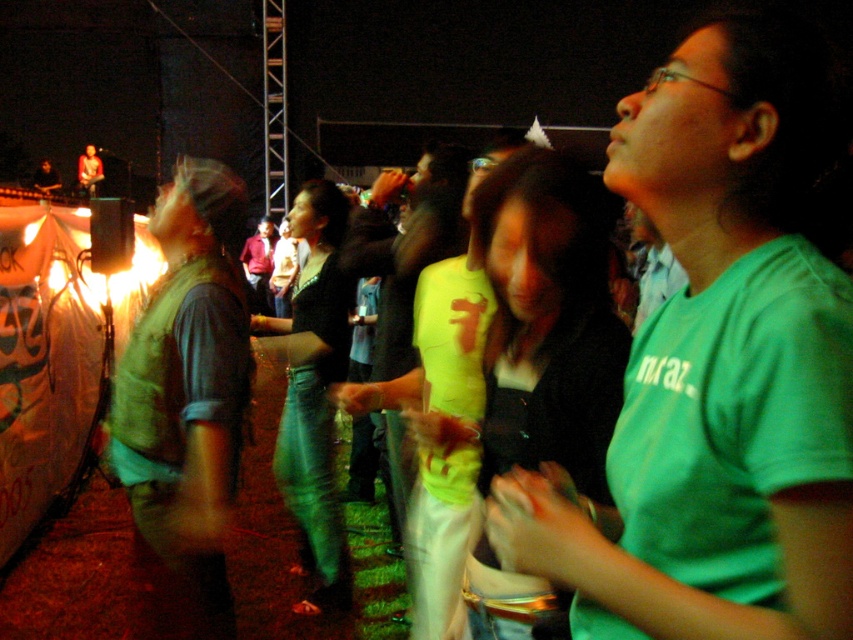
Is green matte shirt at upper right above green matte vest at left?

Correct, green matte shirt at upper right is located above green matte vest at left.

Looking at this image, does green matte shirt at upper right appear on the left side of green matte vest at left?

No, green matte shirt at upper right is not to the left of green matte vest at left.

At what (x,y) coordinates should I click in order to perform the action: click on green matte shirt at upper right. Please return your answer as a coordinate pair (x, y). The image size is (853, 640). Looking at the image, I should click on (718, 365).

Where is `green matte shirt at upper right`? The width and height of the screenshot is (853, 640). green matte shirt at upper right is located at coordinates (718, 365).

Is point (641, 380) positioned after point (340, 227)?

No, it is in front of (340, 227).

Find the location of `green matte shirt at upper right`. green matte shirt at upper right is located at coordinates (718, 365).

This screenshot has height=640, width=853. What do you see at coordinates (718, 365) in the screenshot? I see `green matte shirt at upper right` at bounding box center [718, 365].

Identify the location of green matte shirt at upper right. (718, 365).

Can you confirm if green matte vest at left is positioned above jeans at center?

Correct, green matte vest at left is located above jeans at center.

Does green matte vest at left appear on the left side of jeans at center?

Correct, you'll find green matte vest at left to the left of jeans at center.

Does point (206, 372) come behind point (309, 413)?

No, it is not.

Locate an element on the screen. This screenshot has height=640, width=853. green matte vest at left is located at coordinates (189, 388).